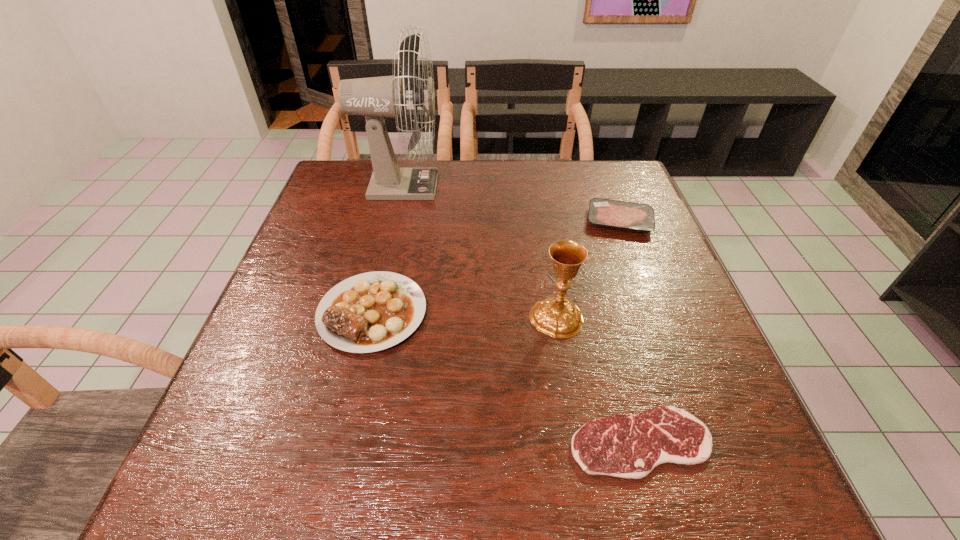
Locate an element on the screen. The image size is (960, 540). vacant point located 0.360m on the back of the tallest steak is located at coordinates (401, 188).

Identify the location of blank space located 0.390m on the left of the farthest steak. The image size is (960, 540). (435, 221).

You are a GUI agent. You are given a task and a screenshot of the screen. Output one action in this format:
    pyautogui.click(x=<x>, y=<y>)
    Task: Click on the free spot located 0.110m on the left of the shortest object
    This screenshot has height=540, width=960.
    Given the screenshot: What is the action you would take?
    pyautogui.click(x=502, y=442)

Locate an element on the screen. This screenshot has width=960, height=540. object that is at the far edge is located at coordinates [375, 98].

Identify the location of object present at the near edge. Image resolution: width=960 pixels, height=540 pixels. (628, 446).

This screenshot has width=960, height=540. I want to click on fan positioned at the left edge, so click(x=375, y=98).

Where is `steak that is positioned at the left edge`? The height and width of the screenshot is (540, 960). steak that is positioned at the left edge is located at coordinates (369, 312).

You are a GUI agent. You are given a task and a screenshot of the screen. Output one action in this format:
    pyautogui.click(x=<x>, y=<y>)
    Task: Click on the object at the far left corner
    This screenshot has height=540, width=960.
    Given the screenshot: What is the action you would take?
    pyautogui.click(x=375, y=98)

Locate an element on the screen. The width and height of the screenshot is (960, 540). object located in the near right corner section of the desktop is located at coordinates (628, 446).

The height and width of the screenshot is (540, 960). In the image, there is a desktop. What are the coordinates of `vacant space at the far edge` in the screenshot? It's located at (442, 180).